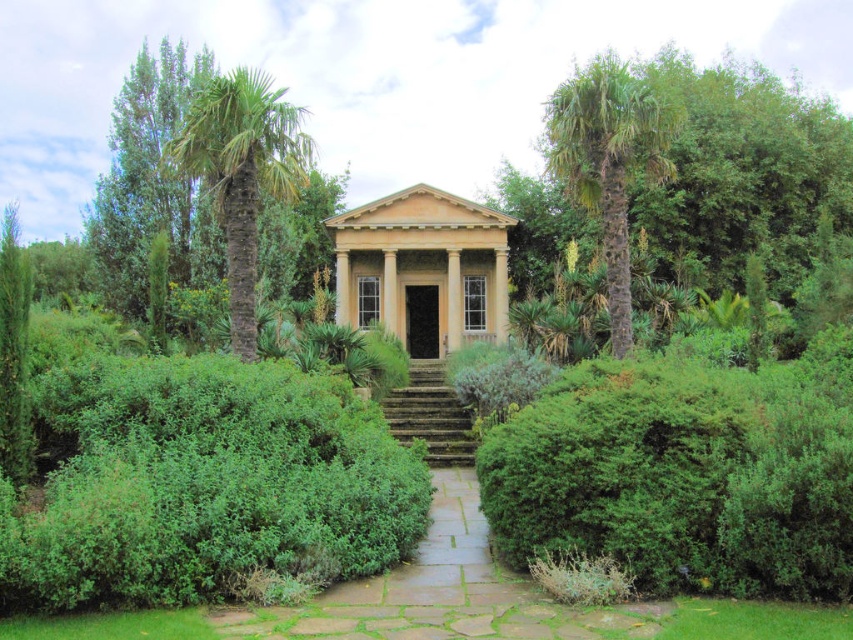
You are standing at the bottom of the stone steps at center in the garden. You want to enter the beige stone gazebo at center. Which direction should you walk to reach the gazebo?

The beige stone gazebo at center is positioned over the stone steps at center, so you should walk upward along the stone steps at center to reach the gazebo.

You are a visitor in the garden and want to take a photo of both green textured palm tree at left and green textured palm tree at right. Which palm tree should you stand closer to in order to capture both in the frame without moving your camera?

You should stand closer to the green textured palm tree at right because it is smaller in size than the green textured palm tree at left, allowing both to fit within the camera frame when positioned appropriately.